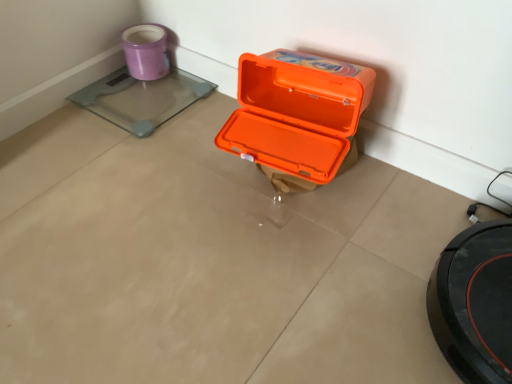
Identify the location of unoccupied area in front of transparent glass scale at upper left. (134, 157).